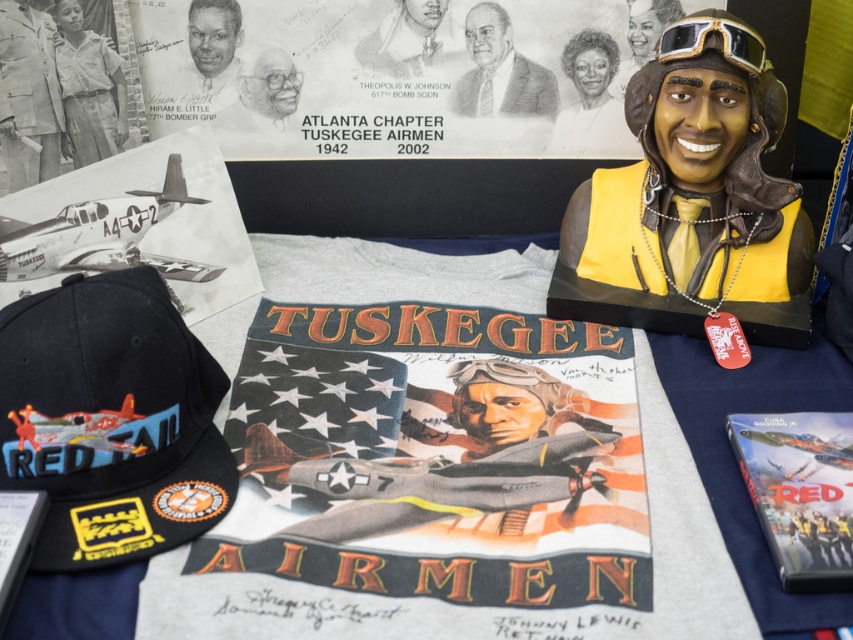
Question: Is light brown leather jacket at upper left smaller than gray pencil sketch of man at upper center?

Choices:
 (A) no
 (B) yes

Answer: (A)

Question: Which of these objects is positioned closest to the black fabric baseball cap at lower left?

Choices:
 (A) smooth skin portrait at upper center
 (B) pencil sketch portrait at upper center

Answer: (B)

Question: Is smooth skin portrait at upper center to the left of smooth black portrait at upper left from the viewer's perspective?

Choices:
 (A) yes
 (B) no

Answer: (B)

Question: Which of the following is the closest to the observer?

Choices:
 (A) pencil sketch portrait at upper center
 (B) smooth black portrait at upper left
 (C) light brown leather jacket at upper left
 (D) light brown uniform at upper left

Answer: (C)

Question: Which point is farther from the camera taking this photo?

Choices:
 (A) (492, 10)
 (B) (222, 99)
 (C) (780, 520)
 (D) (219, 84)

Answer: (B)

Question: Is matte plastic poster at lower right below light brown leather jacket at upper left?

Choices:
 (A) yes
 (B) no

Answer: (A)